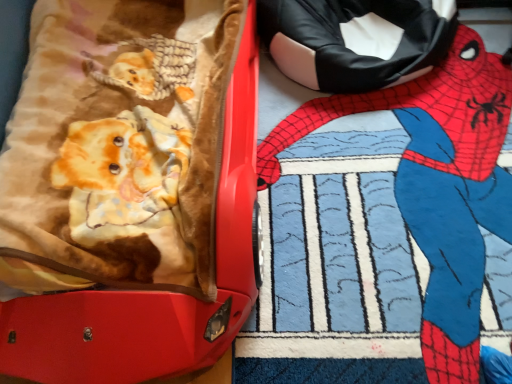
You are a GUI agent. You are given a task and a screenshot of the screen. Output one action in this format:
    pyautogui.click(x=<x>, y=<y>)
    Task: Click on the free area below spider-man costume at upper right (from a real-world perspective)
    The height and width of the screenshot is (384, 512).
    Given the screenshot: What is the action you would take?
    pyautogui.click(x=391, y=204)